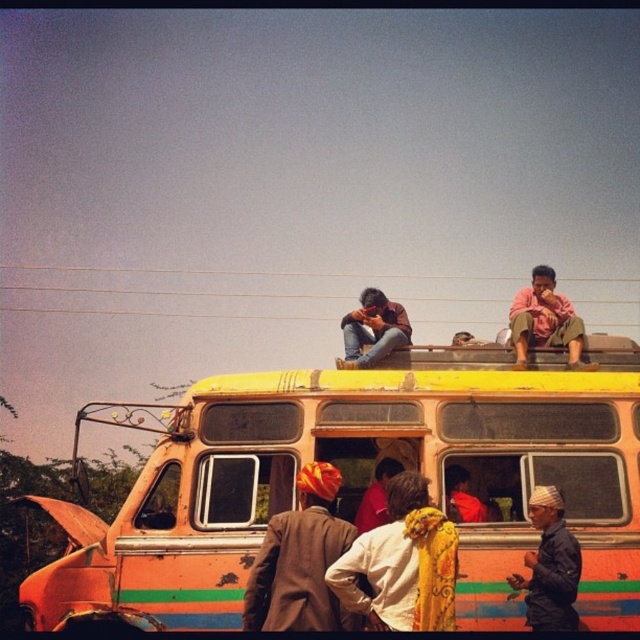
Question: Does pink fabric pants at upper right lie behind jeans at center?

Choices:
 (A) no
 (B) yes

Answer: (A)

Question: Is yellow fabric headscarf at center closer to camera compared to dark blue fabric at lower right?

Choices:
 (A) yes
 (B) no

Answer: (A)

Question: Which is farther from the pink fabric pants at upper right?

Choices:
 (A) brown textured coat at center
 (B) red fabric headscarf at center
 (C) dark blue fabric at lower right

Answer: (A)

Question: Which point is closer to the camera?

Choices:
 (A) yellow fabric headscarf at center
 (B) red fabric headscarf at center
 (C) jeans at center
 (D) pink fabric pants at upper right

Answer: (A)

Question: Which of the following is the farthest from the observer?

Choices:
 (A) (465, 474)
 (B) (401, 522)
 (C) (268, 616)
 (D) (182, 552)

Answer: (A)

Question: Is the position of orange painted bus at center less distant than that of yellow fabric headscarf at center?

Choices:
 (A) yes
 (B) no

Answer: (B)